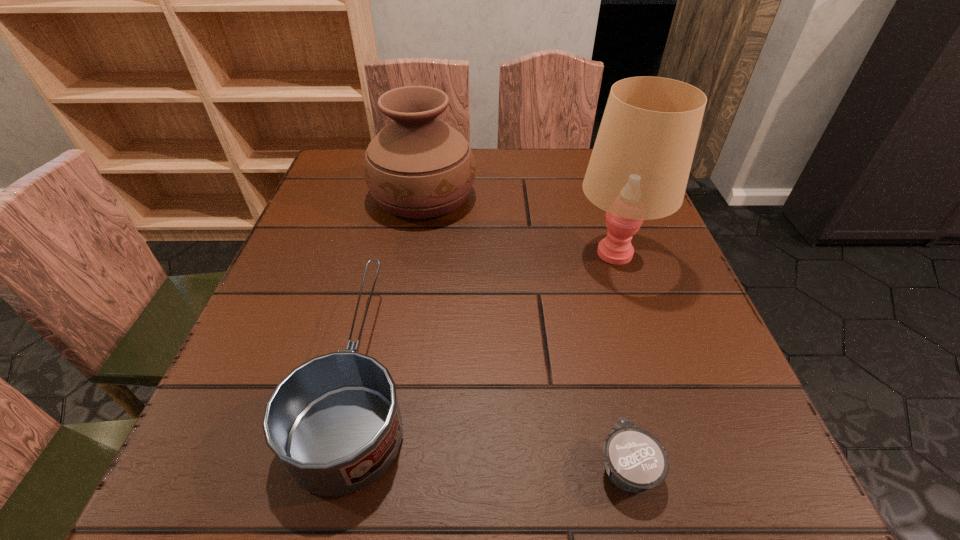
Image resolution: width=960 pixels, height=540 pixels. In order to click on blank space that satisfies the following two spatial constraints: 1. on the front side of the shortest object; 2. on the left side of the urn in this screenshot , I will do `click(378, 466)`.

The image size is (960, 540). I want to click on free space that satisfies the following two spatial constraints: 1. on the back side of the tallest object; 2. on the right side of the shortest object, so click(x=576, y=252).

This screenshot has height=540, width=960. What are the coordinates of `blank space that satisfies the following two spatial constraints: 1. with the handle extending from one side of the saucepan; 2. on the left side of the second tallest object` in the screenshot? It's located at (401, 195).

Locate an element on the screen. The height and width of the screenshot is (540, 960). vacant space that satisfies the following two spatial constraints: 1. with the handle extending from one side of the saucepan; 2. on the right side of the urn is located at coordinates (401, 195).

Find the location of a particular element. The width and height of the screenshot is (960, 540). free location that satisfies the following two spatial constraints: 1. with the handle extending from one side of the second tallest object; 2. on the right side of the second shortest object is located at coordinates (401, 195).